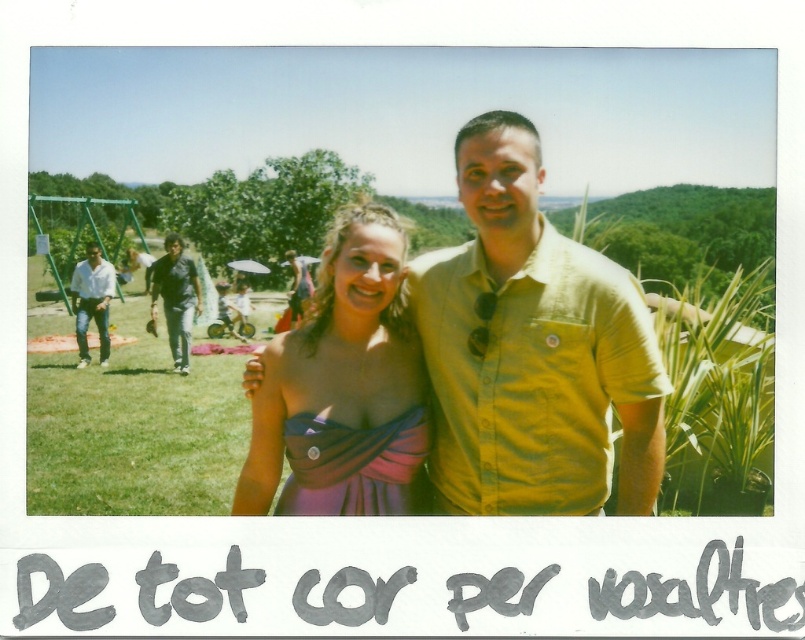
Who is higher up, yellow cotton shirt at center or matte black dress at center?

matte black dress at center is above.

Does yellow cotton shirt at center have a greater width compared to matte black dress at center?

Yes, yellow cotton shirt at center is wider than matte black dress at center.

This screenshot has width=805, height=640. I want to click on yellow cotton shirt at center, so click(x=531, y=349).

This screenshot has height=640, width=805. Describe the element at coordinates (175, 298) in the screenshot. I see `dark blue jeans at left` at that location.

Does point (170, 276) come closer to viewer compared to point (294, 275)?

Yes, it is in front of point (294, 275).

Find the location of a particular element. dark blue jeans at left is located at coordinates (175, 298).

Between yellow cotton shirt at center and purple satin dress at center, which one is positioned lower?

Positioned lower is purple satin dress at center.

Can you confirm if yellow cotton shirt at center is positioned to the left of purple satin dress at center?

Incorrect, yellow cotton shirt at center is not on the left side of purple satin dress at center.

Identify the location of yellow cotton shirt at center. The image size is (805, 640). (531, 349).